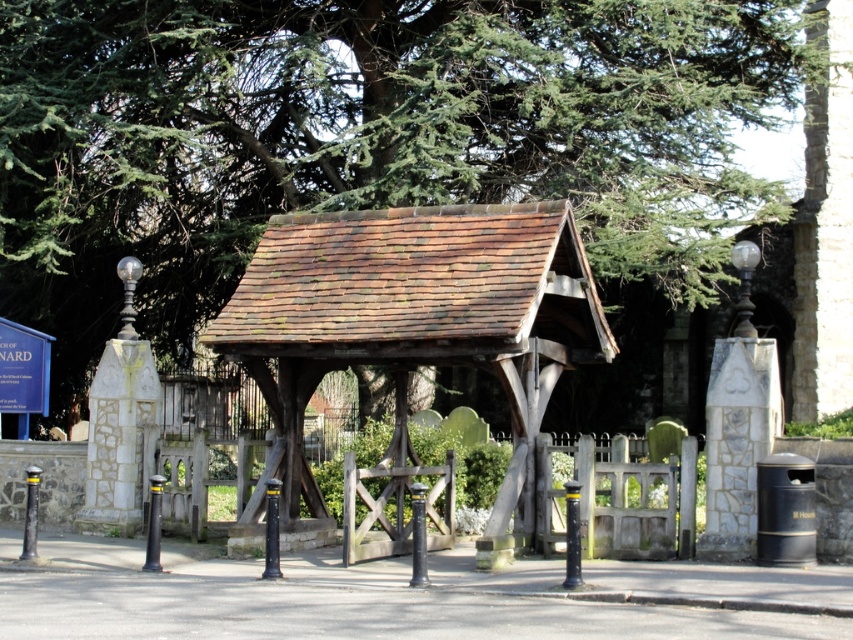
You are standing at the entrance of the churchyard and want to take a photo of the green leafy tree at upper center. Your camera has a maximum focus range of 35 meters. Will you be able to focus on the tree?

The green leafy tree at upper center is 37.92 meters away from the viewer. Since the camera can only focus up to 35 meters, it cannot focus on the tree.

You are standing in front of the rusty wood lychgate at center and want to take a photo of the green leafy tree at upper center. Which direction should you turn to face the tree?

The green leafy tree at upper center is to the right of the rusty wood lychgate at center, so you should turn to your right to face the tree.